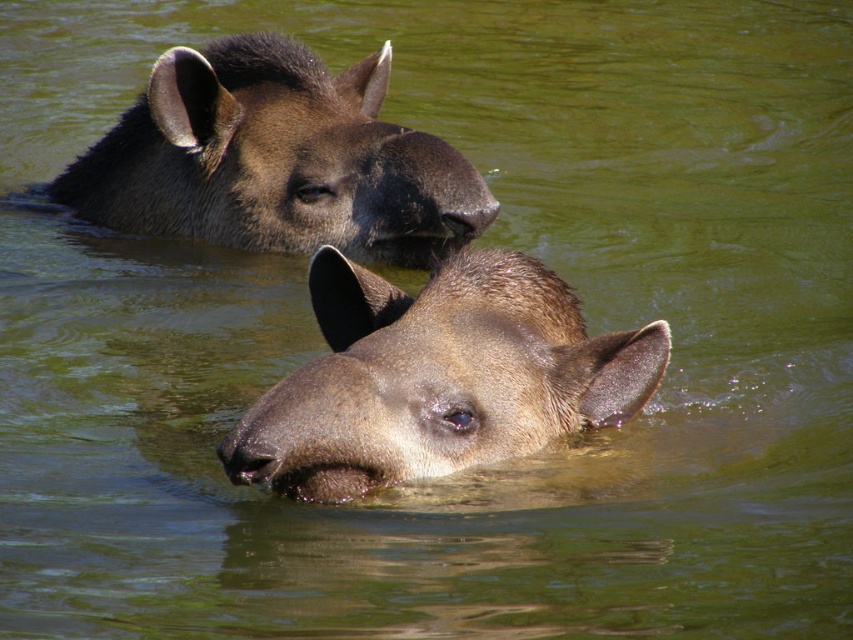
You are a wildlife photographer aiming to capture a closeup of the brown matte tapir head at center and the brown matte tapir at upper center. Since your camera can only focus on one tapir at a time, which tapir should you choose to ensure the subject is fully in frame given their widths?

The brown matte tapir head at center has a smaller width than the brown matte tapir at upper center. Therefore, to ensure the subject is fully in frame, you should choose the brown matte tapir at upper center as it is wider and might be easier to capture in full without cropping.

Based on the photo, you are a wildlife photographer aiming to capture the brown matte tapir head at center. Your camera is set to focus on the point at coordinates point [437,378]. Will this point be sufficient to ensure the tapir is in focus?

The point [437,378] marks the brown matte tapir head at center, so yes, focusing on this point will ensure the tapir is in focus.